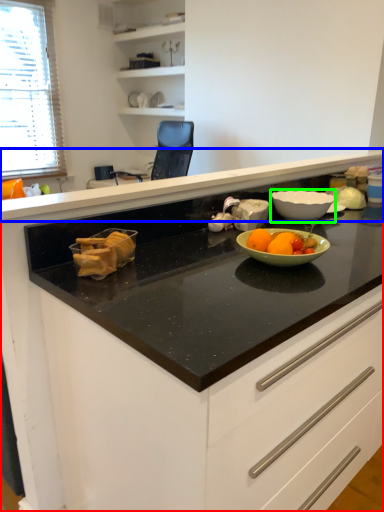
Question: Estimate the real-world distances between objects in this image. Which object is closer to cabinetry (highlighted by a red box), countertop (highlighted by a blue box) or bowl (highlighted by a green box)?

Choices:
 (A) countertop
 (B) bowl

Answer: (A)